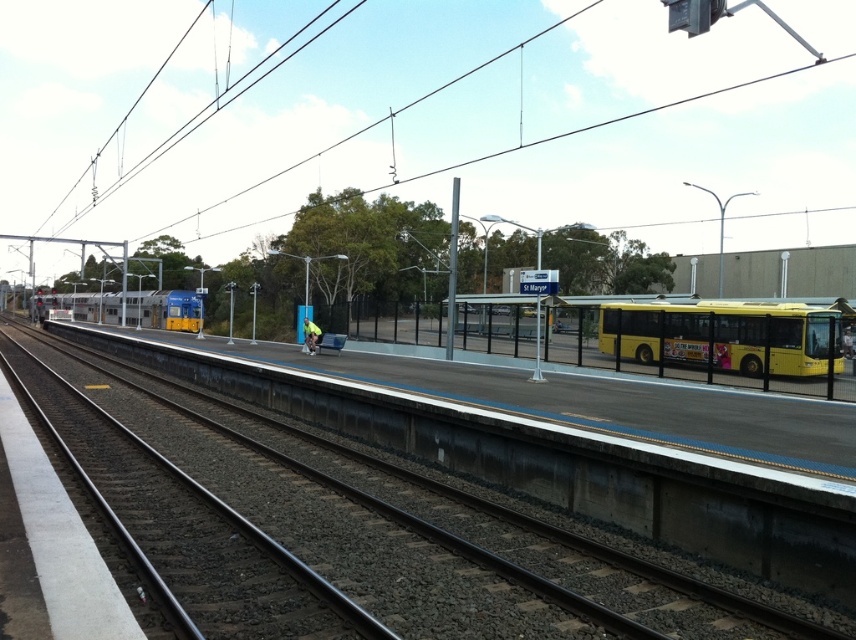
You are a pedestrian standing on the platform at the railway station. You need to cross from the yellow matte bus at right to the silver metallic train at center. Considering their widths, which one would you have to walk around more to get past?

The silver metallic train at center has a greater width than the yellow matte bus at right, so you would need to walk around the silver metallic train at center more to get past it.

You are a passenger waiting at the station and need to board the silver metallic train at center. You see the yellow matte bus at right parked nearby. Which vehicle is larger in size?

The silver metallic train at center is larger in size compared to the yellow matte bus at right.

You are standing on the platform at the railway station. You want to cross to the other side of the metal train track at center. The safety guidelines state that you must stay at least 5 meters away from the track when crossing. Is the distance sufficient for safe crossing?

The metal train track at center is 5.72 meters away from the viewer. Since the safety guideline requires staying at least 5 meters away, the distance is sufficient for safe crossing.